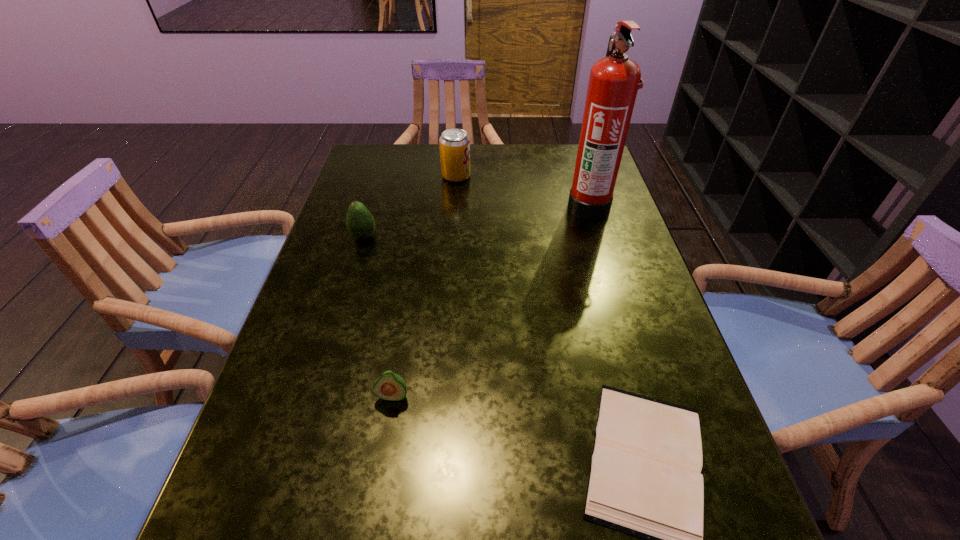
The height and width of the screenshot is (540, 960). I want to click on the tallest object, so click(x=614, y=80).

Locate an element on the screen. This screenshot has height=540, width=960. the second farthest object is located at coordinates (614, 80).

Find the location of `pop (soda)`. pop (soda) is located at coordinates (454, 144).

This screenshot has width=960, height=540. What are the coordinates of `the farthest object` in the screenshot? It's located at (454, 144).

Locate an element on the screen. The image size is (960, 540). the left avocado is located at coordinates (360, 223).

Find the location of a particular element. the leftmost object is located at coordinates (360, 223).

The height and width of the screenshot is (540, 960). In order to click on the right avocado in this screenshot , I will do [x=389, y=386].

Locate an element on the screen. the shorter avocado is located at coordinates (389, 386).

I want to click on vacant area situated with the nozzle pointing from the back of the tallest object, so click(498, 206).

Find the location of a particular element. This screenshot has width=960, height=540. vacant position located 0.150m with the nozzle pointing from the back of the tallest object is located at coordinates (513, 206).